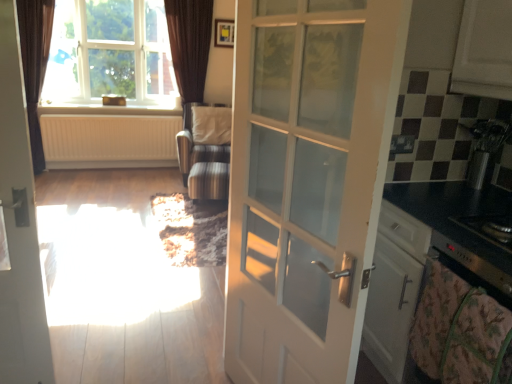
Question: From a real-world perspective, relative to metallic stainless steel kettle at right, positioned as the 2th appliance in front-to-back order, is black glass stove at right, the second appliance when ordered from top to bottom, vertically above or below?

Choices:
 (A) below
 (B) above

Answer: (A)

Question: Considering the positions of black glass stove at right, the second appliance when ordered from top to bottom, and metallic stainless steel kettle at right, the 1th appliance viewed from the back, in the image, is black glass stove at right, the second appliance when ordered from top to bottom, taller or shorter than metallic stainless steel kettle at right, the 1th appliance viewed from the back,?

Choices:
 (A) tall
 (B) short

Answer: (B)

Question: Which of these objects is positioned farthest from the black glass stove at right, the first appliance in the bottom-to-top sequence?

Choices:
 (A) white matte radiator at upper left
 (B) white glossy door at left, placed as the 2th door when sorted from right to left
 (C) white matte cabinet at upper right
 (D) striped fabric armchair at center
 (E) brown velvet curtain at upper left

Answer: (E)

Question: Which object is the farthest from the clear glass window at upper left?

Choices:
 (A) floral cotton blanket at lower right
 (B) black glass stove at right, placed as the second appliance when sorted from back to front
 (C) white matte cabinet at upper right
 (D) brown velvet curtain at upper left
 (E) white glossy door at center, which appears as the 1th door when viewed from the right

Answer: (A)